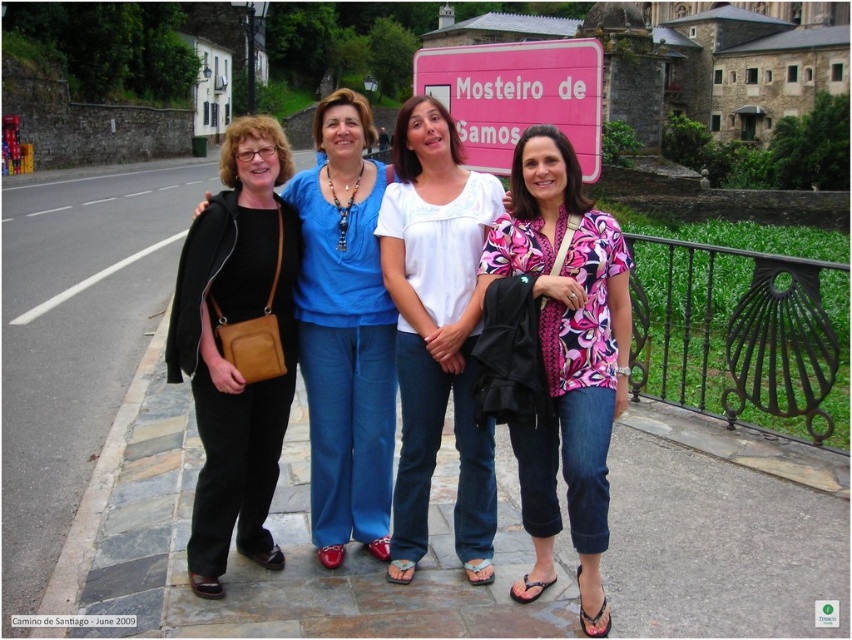
You are a photographer trying to capture a clear shot of the Mosteiro de Samos sign in the background. The black leather pants at left and the gray stone curb at lower left are blocking the view. Which object should you move to ensure the sign is fully visible?

The black leather pants at left are wider than the gray stone curb at lower left, so moving the black leather pants at left would be more effective in clearing the view of the Mosteiro de Samos sign.

You are a photographer trying to adjust the composition of the image. The scene has a pink floral blouse at center and black leather pants at left. Which object is narrower in width?

The pink floral blouse at center is thinner than the black leather pants at left, so the pink floral blouse at center is narrower in width.

You are standing in front of the Mosteiro de Samos with the four women in the image. You want to take a photo of the two points marked in the scene. Which point, point [603,284] or point [384,364], is closer to you?

Point [603,284] is closer to the viewer than point [384,364].